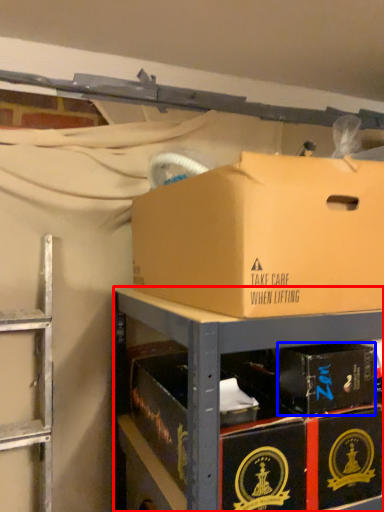
Question: Among these objects, which one is farthest to the camera, shelf (highlighted by a red box) or box (highlighted by a blue box)?

Choices:
 (A) shelf
 (B) box

Answer: (B)